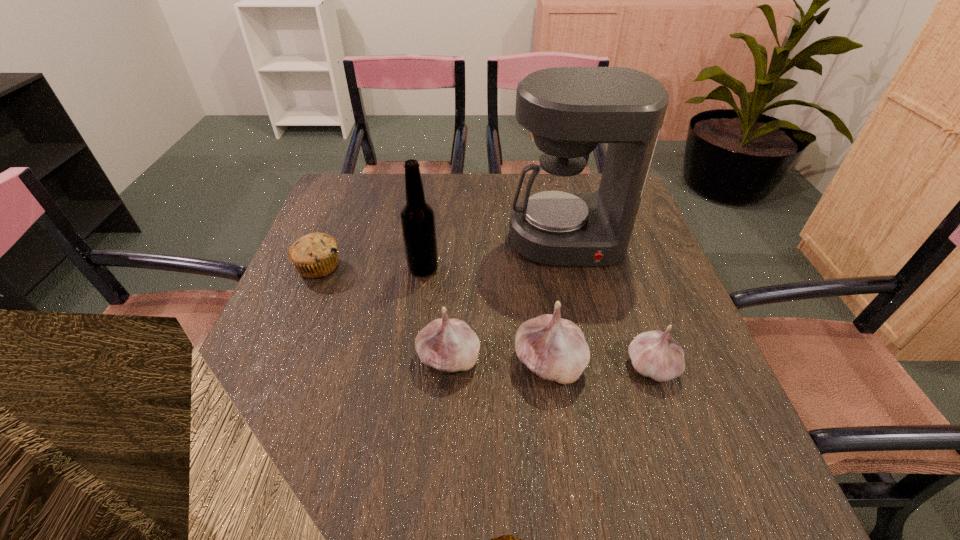
In the image, there is a desktop. Where is `vacant space at the far edge`? vacant space at the far edge is located at coordinates (432, 186).

Locate an element on the screen. This screenshot has width=960, height=540. vacant region at the left edge is located at coordinates (341, 267).

Locate an element on the screen. The image size is (960, 540). vacant space at the right edge of the desktop is located at coordinates (684, 393).

The image size is (960, 540). Identify the location of vacant space at the far left corner of the desktop. (327, 194).

Find the location of a particular element. vacant region between the leftmost garlic and the leftmost object is located at coordinates (384, 313).

Find the location of a particular element. The image size is (960, 540). free area in between the tallest object and the second shortest garlic is located at coordinates (508, 300).

Where is `empty space that is in between the shortest object and the tallest object`? The image size is (960, 540). empty space that is in between the shortest object and the tallest object is located at coordinates (443, 254).

You are a GUI agent. You are given a task and a screenshot of the screen. Output one action in this format:
    pyautogui.click(x=<x>, y=<y>)
    Task: Click on the vacant region between the second garlic from right to left and the shortest object
    The height and width of the screenshot is (540, 960).
    Given the screenshot: What is the action you would take?
    pyautogui.click(x=434, y=314)

The image size is (960, 540). In order to click on vacant space that's between the coffee maker and the fifth shortest object in this screenshot , I will do `click(495, 254)`.

In order to click on vacant area between the leftmost garlic and the second garlic from right to left in this screenshot , I will do `click(499, 361)`.